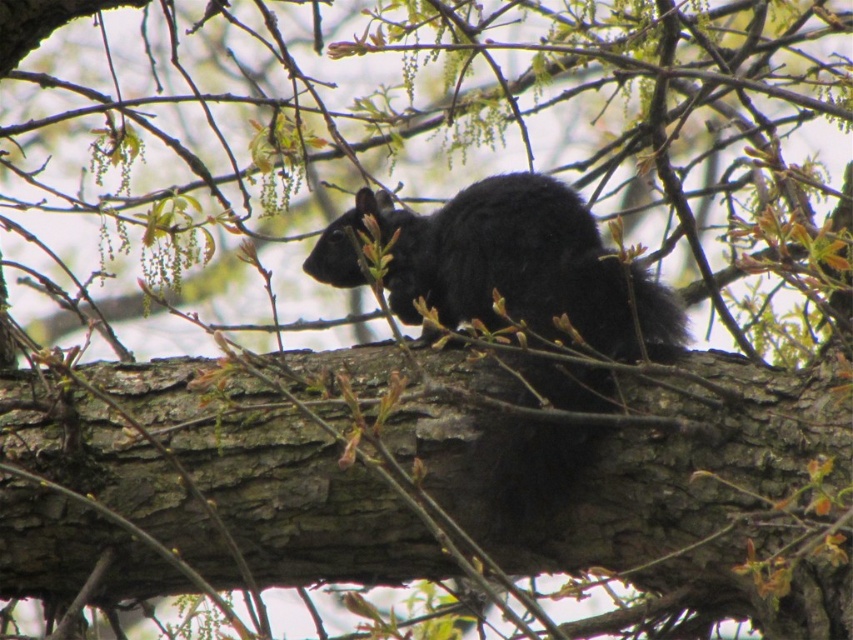
Is brown rough tree trunk at center positioned in front of black furry squirrel at center?

Yes, brown rough tree trunk at center is in front of black furry squirrel at center.

From the picture: Which is more to the left, brown rough tree trunk at center or black furry squirrel at center?

brown rough tree trunk at center

Where is `brown rough tree trunk at center`? The width and height of the screenshot is (853, 640). brown rough tree trunk at center is located at coordinates (639, 476).

You are a GUI agent. You are given a task and a screenshot of the screen. Output one action in this format:
    pyautogui.click(x=<x>, y=<y>)
    Task: Click on the brown rough tree trunk at center
    Image resolution: width=853 pixels, height=640 pixels.
    Given the screenshot: What is the action you would take?
    pyautogui.click(x=639, y=476)